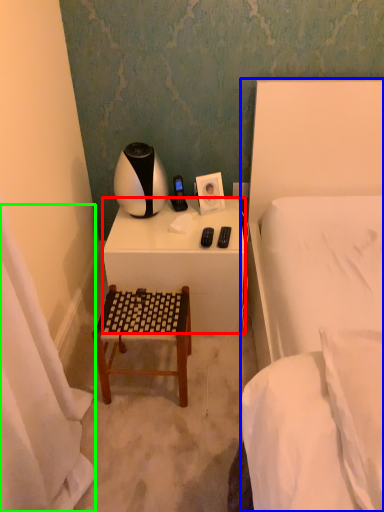
Question: Estimate the real-world distances between objects in this image. Which object is closer to desk (highlighted by a red box), bed (highlighted by a blue box) or curtain (highlighted by a green box)?

Choices:
 (A) bed
 (B) curtain

Answer: (A)